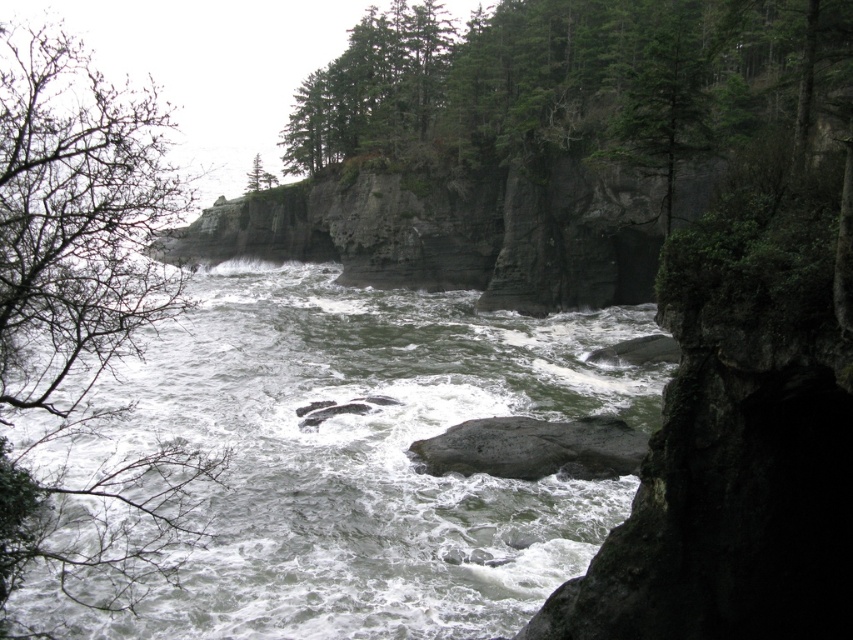
You are a hiker trying to cross the turbulent river. You notice a gray rough rock at center and a green matte tree at upper center. Which object is larger in size?

The gray rough rock at center is smaller than the green matte tree at upper center, so the green matte tree at upper center is larger in size.